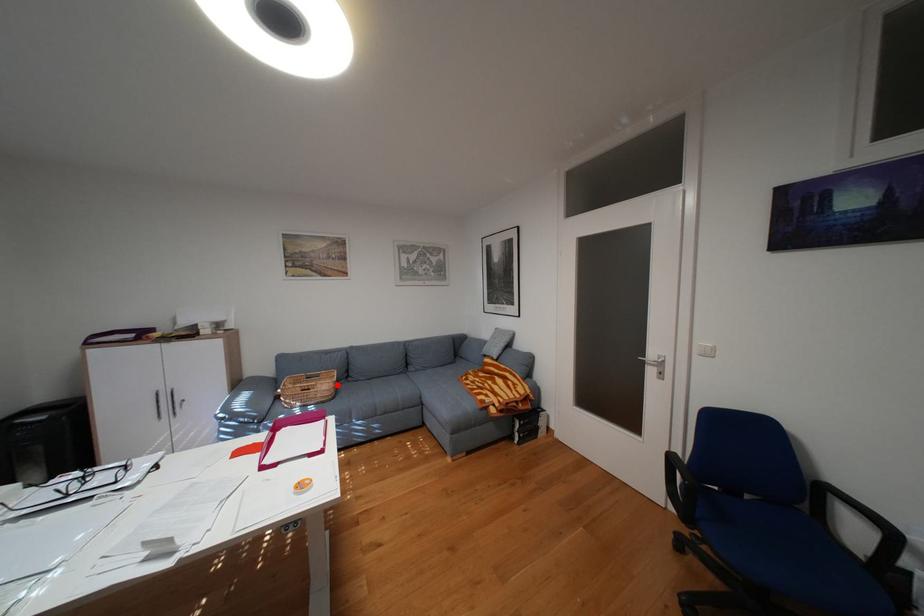
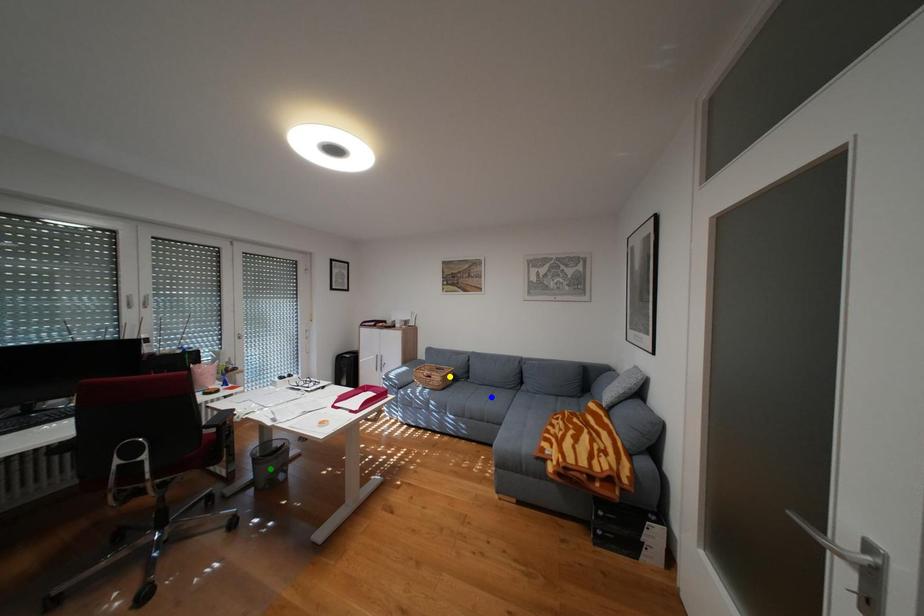
Question: I am providing you with two images of the same scene from different viewpoints. A red point is marked on the first image. You are given multiple points on the second image. Which spot in image 2 lines up with the point in image 1?

Choices:
 (A) blue point
 (B) yellow point
 (C) green point

Answer: (B)